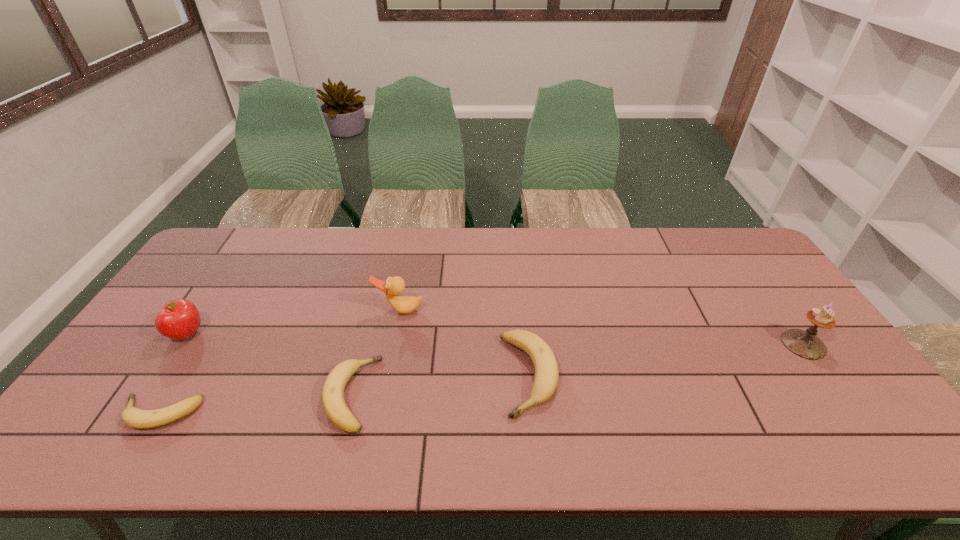
Locate an element on the screen. The height and width of the screenshot is (540, 960). vacant area that satisfies the following two spatial constraints: 1. on the beak of the tallest object; 2. on the right side of the farthest object is located at coordinates (394, 344).